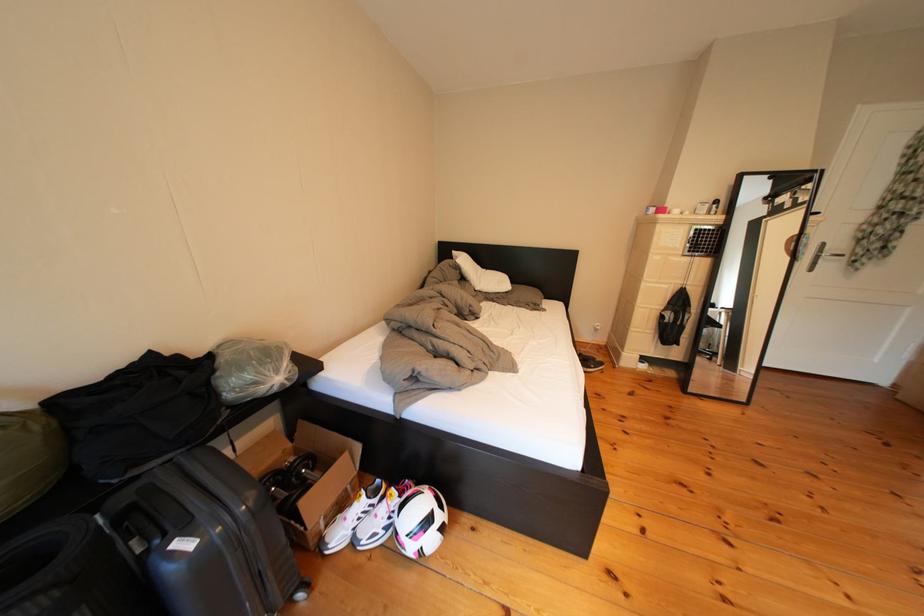
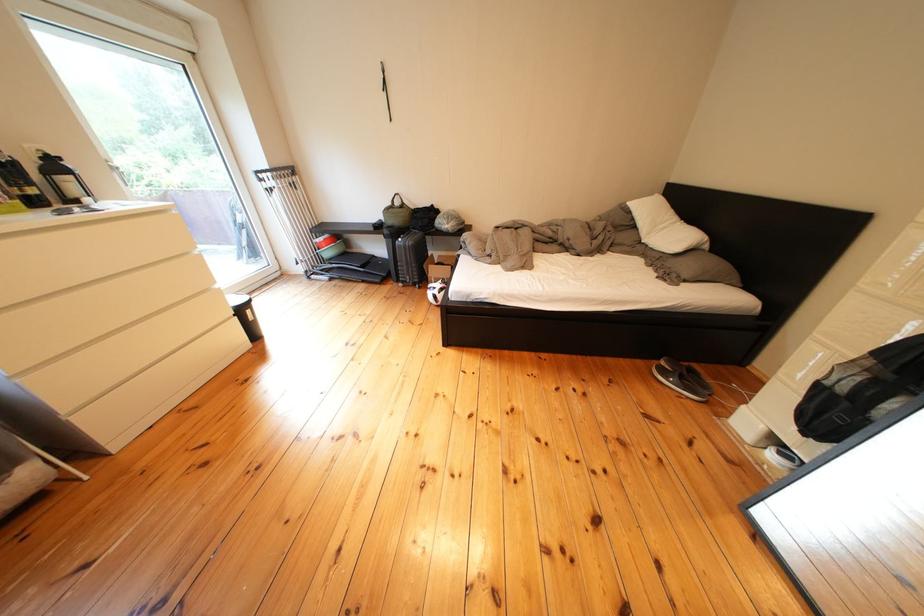
Where in the second image is the point corresponding to point 478,284 from the first image?

(649, 230)